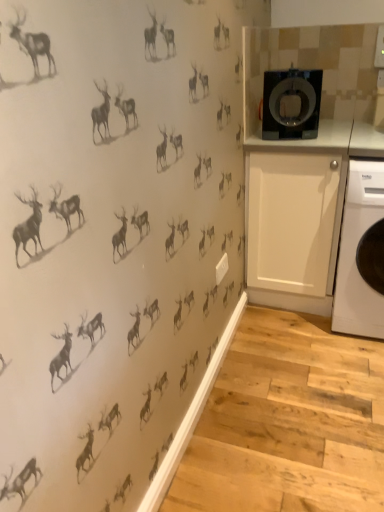
This screenshot has width=384, height=512. What do you see at coordinates (356, 252) in the screenshot? I see `white plastic washing machine at right` at bounding box center [356, 252].

Image resolution: width=384 pixels, height=512 pixels. Find the location of `white matte cabinet at right`. white matte cabinet at right is located at coordinates (295, 218).

Is white plastic washing machine at right inside black glossy washing machine at upper right?

That's incorrect, white plastic washing machine at right is not inside black glossy washing machine at upper right.

From the image's perspective, relative to white plastic washing machine at right, is black glossy washing machine at upper right above or below?

Based on their image positions, black glossy washing machine at upper right is located above white plastic washing machine at right.

From a real-world perspective, is black glossy washing machine at upper right located higher than white plastic washing machine at right?

Yes, from a real-world perspective, black glossy washing machine at upper right is above white plastic washing machine at right.

Which of these two, black glossy washing machine at upper right or white plastic washing machine at right, is wider?

white plastic washing machine at right.

Relative to white matte cabinet at right, is white plastic washing machine at right in front or behind?

Result: white plastic washing machine at right is in front of white matte cabinet at right.

Considering the points (375, 315) and (281, 271), which point is in front, point (375, 315) or point (281, 271)?

The point (375, 315) is in front.

From a real-world perspective, is white plastic washing machine at right positioned over white matte cabinet at right based on gravity?

No.

Based on their sizes in the image, would you say white plastic washing machine at right is bigger or smaller than white matte cabinet at right?

Clearly, white plastic washing machine at right is smaller in size than white matte cabinet at right.

From the image's perspective, is white matte cabinet at right located above or below white plastic washing machine at right?

white matte cabinet at right is above white plastic washing machine at right.

Is white matte cabinet at right oriented away from white plastic washing machine at right?

That's not correct — white matte cabinet at right is not looking away from white plastic washing machine at right.

Based on the photo, between white matte cabinet at right and white plastic washing machine at right, which one is positioned behind?

white matte cabinet at right is further from the camera.

From a real-world perspective, who is located higher, white matte cabinet at right or white plastic washing machine at right?

white matte cabinet at right, from a real-world perspective.

Considering the relative sizes of white matte cabinet at right and black glossy washing machine at upper right in the image provided, is white matte cabinet at right taller than black glossy washing machine at upper right?

Indeed, white matte cabinet at right has a greater height compared to black glossy washing machine at upper right.

From the image's perspective, is white matte cabinet at right over black glossy washing machine at upper right?

No, from the image's perspective, white matte cabinet at right is not over black glossy washing machine at upper right.

Is point (269, 266) farther from viewer compared to point (280, 79)?

That is True.

Which object is closer to the camera, black glossy washing machine at upper right or white matte cabinet at right?

black glossy washing machine at upper right.

Consider the image. From the image's perspective, is black glossy washing machine at upper right under white matte cabinet at right?

No, from the image's perspective, black glossy washing machine at upper right is not below white matte cabinet at right.

Is black glossy washing machine at upper right shorter than white matte cabinet at right?

Yes, black glossy washing machine at upper right is shorter than white matte cabinet at right.

Does black glossy washing machine at upper right turn towards white matte cabinet at right?

No, black glossy washing machine at upper right is not turned towards white matte cabinet at right.

Which object is more forward, white plastic washing machine at right or black glossy washing machine at upper right?

white plastic washing machine at right is more forward.

Where is `washing machine that is on the left side of white plastic washing machine at right`? washing machine that is on the left side of white plastic washing machine at right is located at coordinates (291, 104).

Between white plastic washing machine at right and black glossy washing machine at upper right, which one has more height?

Standing taller between the two is white plastic washing machine at right.

Identify the location of washing machine on the left side of white plastic washing machine at right. (291, 104).

Locate an element on the screen. This screenshot has height=512, width=384. cabinetry above the white plastic washing machine at right (from a real-world perspective) is located at coordinates (295, 218).

Which object lies nearer to the anchor point white plastic washing machine at right, black glossy washing machine at upper right or white matte cabinet at right?

Based on the image, white matte cabinet at right appears to be nearer to white plastic washing machine at right.

Considering their positions, is black glossy washing machine at upper right positioned further to white matte cabinet at right than white plastic washing machine at right?

black glossy washing machine at upper right.

Looking at the image, which one is located closer to black glossy washing machine at upper right, white matte cabinet at right or white plastic washing machine at right?

Based on the image, white matte cabinet at right appears to be nearer to black glossy washing machine at upper right.

When comparing their distances from black glossy washing machine at upper right, does white plastic washing machine at right or white matte cabinet at right seem closer?

Among the two, white matte cabinet at right is located nearer to black glossy washing machine at upper right.

Estimate the real-world distances between objects in this image. Which object is further from white matte cabinet at right, white plastic washing machine at right or black glossy washing machine at upper right?

black glossy washing machine at upper right lies further to white matte cabinet at right than the other object.

Considering their positions, is white matte cabinet at right positioned closer to white plastic washing machine at right than black glossy washing machine at upper right?

white matte cabinet at right lies closer to white plastic washing machine at right than the other object.

Where is `cabinetry between black glossy washing machine at upper right and white plastic washing machine at right in the up-down direction`? cabinetry between black glossy washing machine at upper right and white plastic washing machine at right in the up-down direction is located at coordinates (295, 218).